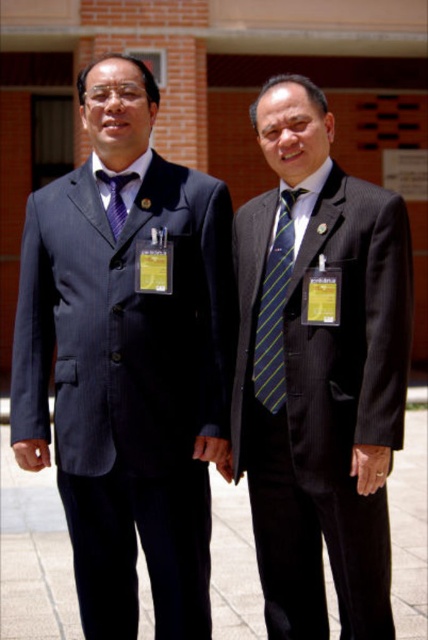
Question: Is green striped tie at center above matte purple tie at left?

Choices:
 (A) no
 (B) yes

Answer: (A)

Question: Which point is farther from the camera taking this photo?

Choices:
 (A) (258, 348)
 (B) (279, 400)
 (C) (95, 176)
 (D) (95, 400)

Answer: (C)

Question: Does green striped tie at center appear under matte purple tie at left?

Choices:
 (A) no
 (B) yes

Answer: (B)

Question: Can you confirm if dark pinstripe suit at center is positioned above green striped tie at center?

Choices:
 (A) yes
 (B) no

Answer: (B)

Question: Among these points, which one is nearest to the camera?

Choices:
 (A) (133, 177)
 (B) (53, 195)
 (C) (275, 268)
 (D) (291, 573)

Answer: (D)

Question: Which object is farther from the camera taking this photo?

Choices:
 (A) matte purple tie at left
 (B) green striped tie at center

Answer: (A)